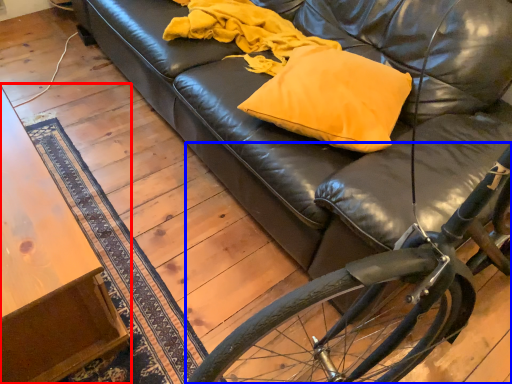
Question: Among these objects, which one is farthest to the camera, table (highlighted by a red box) or bicycle (highlighted by a blue box)?

Choices:
 (A) table
 (B) bicycle

Answer: (A)